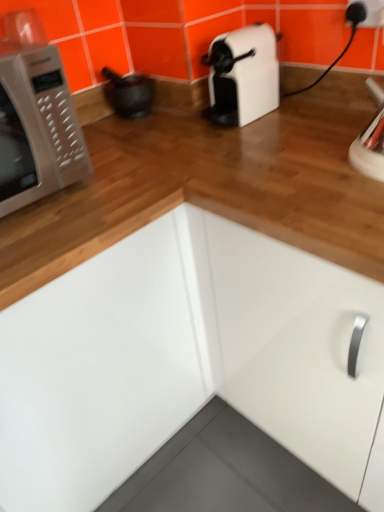
Question: From the image's perspective, is matte black mortar at upper left over white plastic electric outlet at upper right?

Choices:
 (A) no
 (B) yes

Answer: (A)

Question: From a real-world perspective, is matte black mortar at upper left below white plastic electric outlet at upper right?

Choices:
 (A) yes
 (B) no

Answer: (A)

Question: Can you confirm if matte black mortar at upper left is positioned to the right of white plastic electric outlet at upper right?

Choices:
 (A) yes
 (B) no

Answer: (B)

Question: Is the surface of matte black mortar at upper left in direct contact with white plastic electric outlet at upper right?

Choices:
 (A) no
 (B) yes

Answer: (A)

Question: Can you confirm if matte black mortar at upper left is smaller than white plastic electric outlet at upper right?

Choices:
 (A) no
 (B) yes

Answer: (A)

Question: Is matte black mortar at upper left located outside white plastic electric outlet at upper right?

Choices:
 (A) no
 (B) yes

Answer: (B)

Question: Is white glossy cabinet at center taller than matte black mortar at upper left?

Choices:
 (A) yes
 (B) no

Answer: (A)

Question: From the image's perspective, does white glossy cabinet at center appear lower than matte black mortar at upper left?

Choices:
 (A) no
 (B) yes

Answer: (B)

Question: Is white glossy cabinet at center bigger than matte black mortar at upper left?

Choices:
 (A) yes
 (B) no

Answer: (A)

Question: Does white glossy cabinet at center turn towards matte black mortar at upper left?

Choices:
 (A) yes
 (B) no

Answer: (B)

Question: Is white glossy cabinet at center at the left side of matte black mortar at upper left?

Choices:
 (A) no
 (B) yes

Answer: (A)

Question: Is white glossy cabinet at center wider than matte black mortar at upper left?

Choices:
 (A) no
 (B) yes

Answer: (B)

Question: From a real-world perspective, is white glossy microwave oven at left physically below white glossy cabinet at center?

Choices:
 (A) no
 (B) yes

Answer: (A)